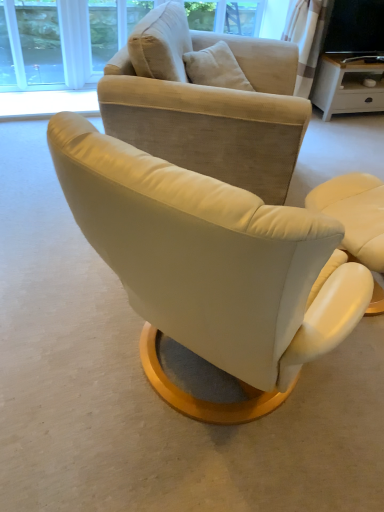
Locate an element on the screen. vacant area in front of matte white desk at upper right is located at coordinates [x=340, y=138].